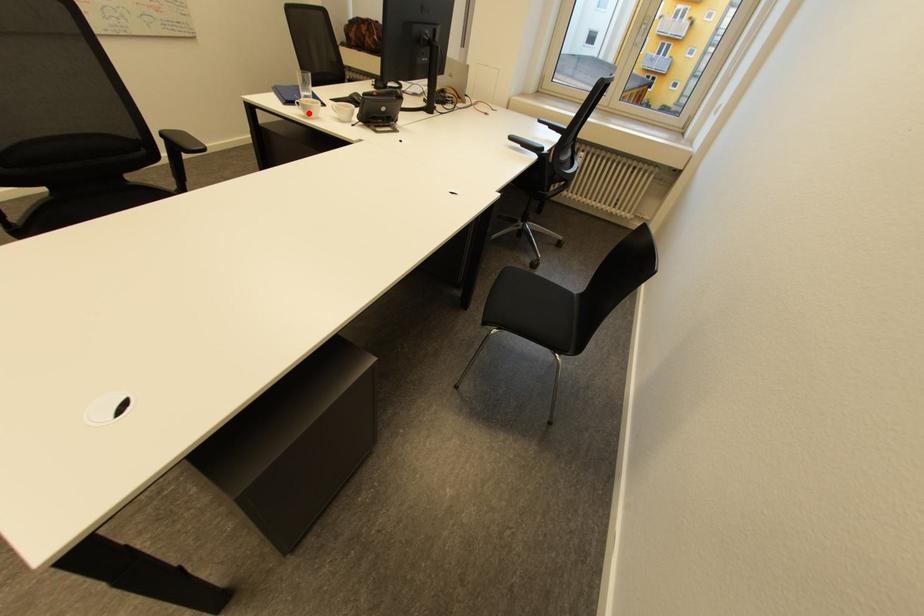
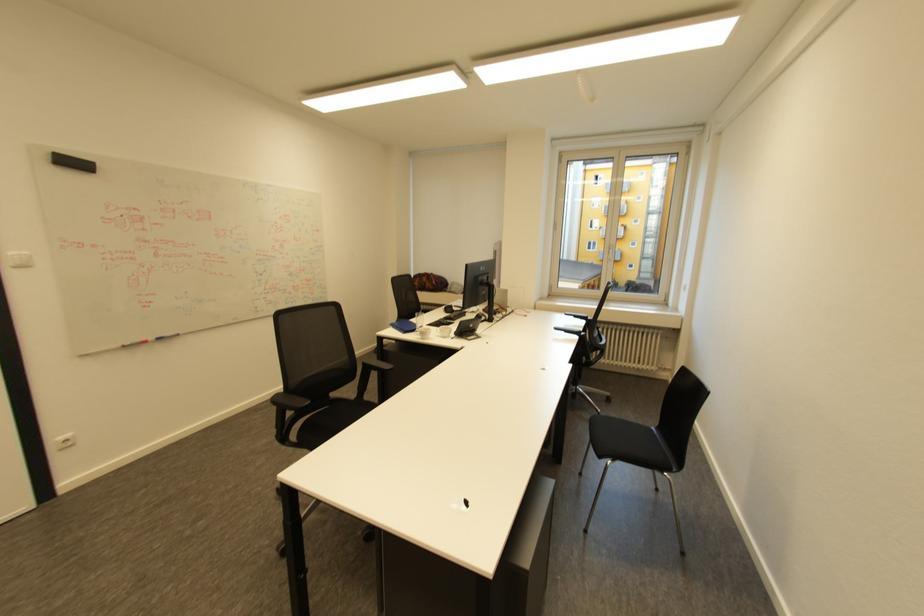
Find the pixel in the second image that matches the highlighted location in the first image.

(426, 337)